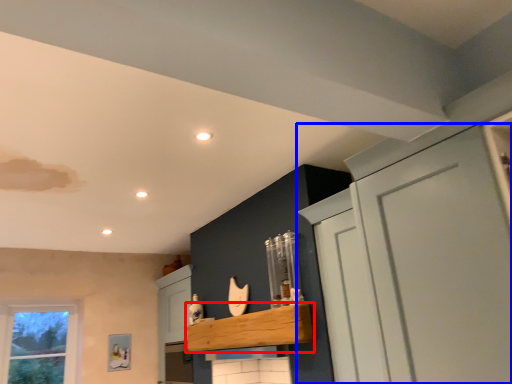
Question: Which point is closer to the camera, cabinetry (highlighted by a red box) or cupboard (highlighted by a blue box)?

Choices:
 (A) cabinetry
 (B) cupboard

Answer: (B)